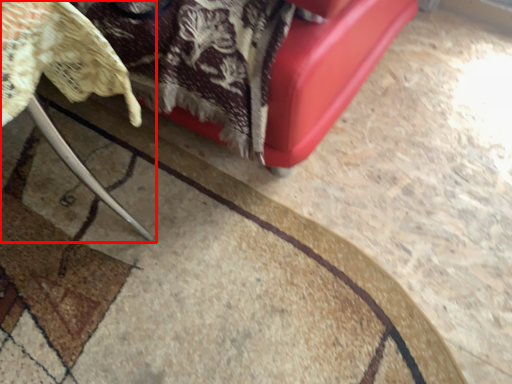
Question: From the image's perspective, considering the relative positions of furniture (annotated by the red box) and mat in the image provided, where is furniture (annotated by the red box) located with respect to the staircase?

Choices:
 (A) above
 (B) below

Answer: (A)